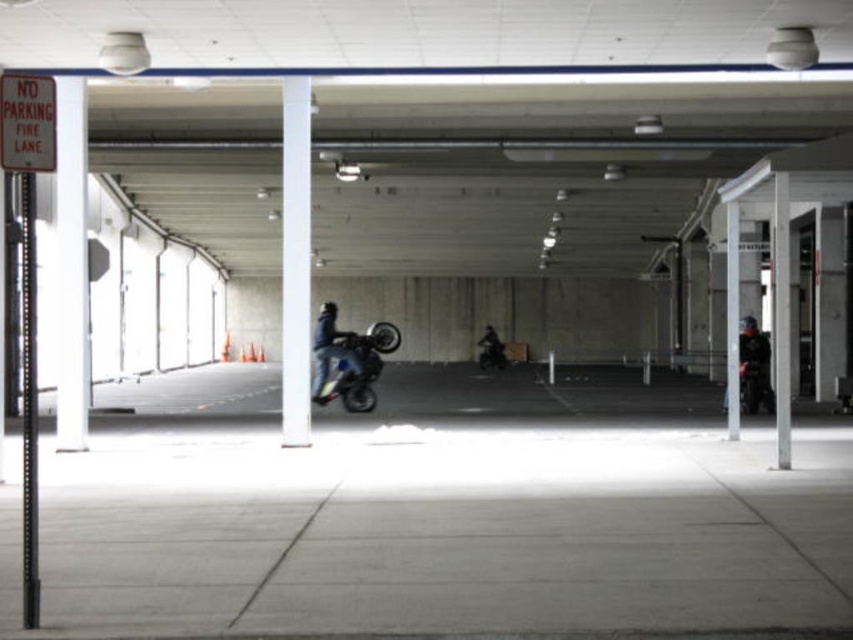
Between white paper sign at upper left and shiny metallic motorcycle at center, which one has less height?

With less height is white paper sign at upper left.

Can you confirm if white paper sign at upper left is shorter than shiny metallic motorcycle at center?

Indeed, white paper sign at upper left has a lesser height compared to shiny metallic motorcycle at center.

Between point (32, 140) and point (352, 332), which one is positioned behind?

The point (352, 332) is more distant.

Identify the location of white paper sign at upper left. This screenshot has width=853, height=640. (27, 122).

Between white paper sign at upper left and shiny chrome motorcycle at center, which one appears on the right side from the viewer's perspective?

From the viewer's perspective, shiny chrome motorcycle at center appears more on the right side.

Who is more forward, (16, 115) or (498, 340)?

Point (16, 115)

This screenshot has width=853, height=640. I want to click on white paper sign at upper left, so click(27, 122).

Can you confirm if shiny metallic motorcycle at center is wider than shiny blue motorcycle at center?

In fact, shiny metallic motorcycle at center might be narrower than shiny blue motorcycle at center.

Who is positioned more to the right, shiny metallic motorcycle at center or shiny blue motorcycle at center?

Positioned to the right is shiny metallic motorcycle at center.

In order to click on shiny metallic motorcycle at center in this screenshot , I will do `click(355, 365)`.